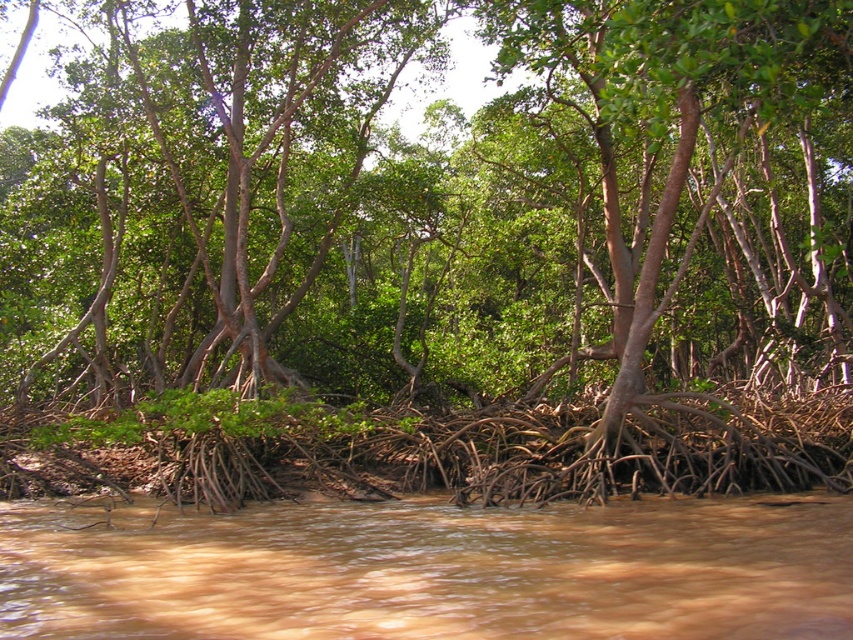
Does point (194, 42) lie in front of point (194, 552)?

No, (194, 42) is further to viewer.

Measure the distance between point (x=222, y=352) and camera.

They are 24.23 meters apart.

The width and height of the screenshot is (853, 640). Find the location of `green matte tree at center`. green matte tree at center is located at coordinates (196, 186).